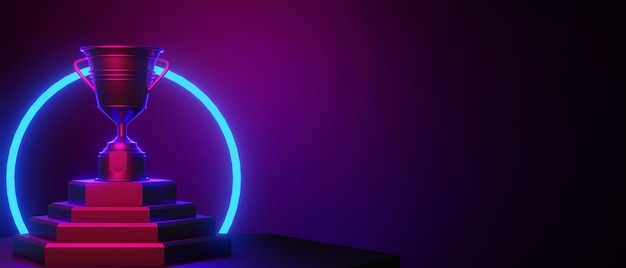
Find the location of `pedestal`. pedestal is located at coordinates (136, 186).